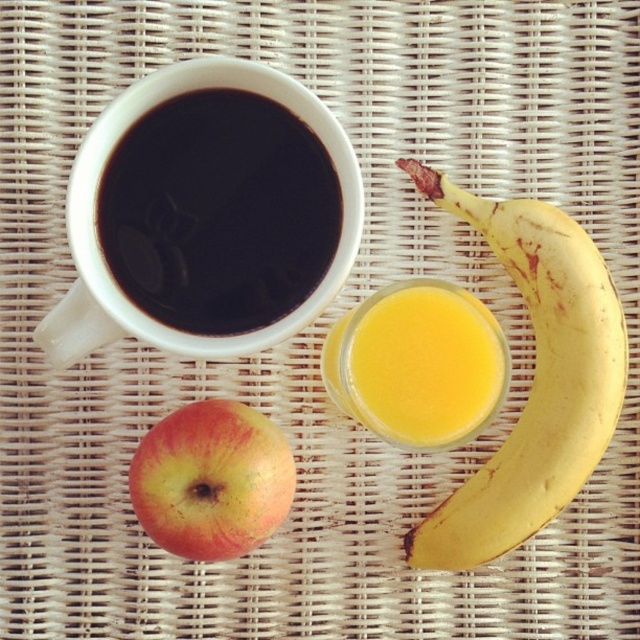
From the picture: Which is above, yellow matte banana at lower right or translucent yellow liquid at center?

translucent yellow liquid at center is above.

Can you confirm if yellow matte banana at lower right is shorter than translucent yellow liquid at center?

Incorrect, yellow matte banana at lower right's height does not fall short of translucent yellow liquid at center's.

Is point (508, 253) closer to camera compared to point (432, 400)?

No, (508, 253) is behind (432, 400).

The height and width of the screenshot is (640, 640). I want to click on yellow matte banana at lower right, so click(532, 380).

Does point (273, 262) come behind point (147, 532)?

No.

Image resolution: width=640 pixels, height=640 pixels. Identify the location of black matte cup at upper left. (218, 212).

Between point (273, 220) and point (173, 483), which one is positioned behind?

Point (173, 483)

Where is `black matte cup at upper left`? This screenshot has height=640, width=640. black matte cup at upper left is located at coordinates (218, 212).

Does point (403, 291) come in front of point (134, 481)?

Yes.

Who is more distant from viewer, (424,445) or (189,488)?

The point (424,445) is more distant.

Locate an element on the screen. translucent yellow liquid at center is located at coordinates (426, 364).